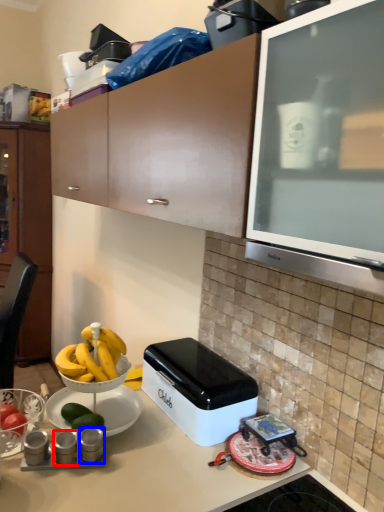
Question: Which object appears farthest to the camera in this image, appliance (highlighted by a red box) or appliance (highlighted by a blue box)?

Choices:
 (A) appliance
 (B) appliance

Answer: (A)